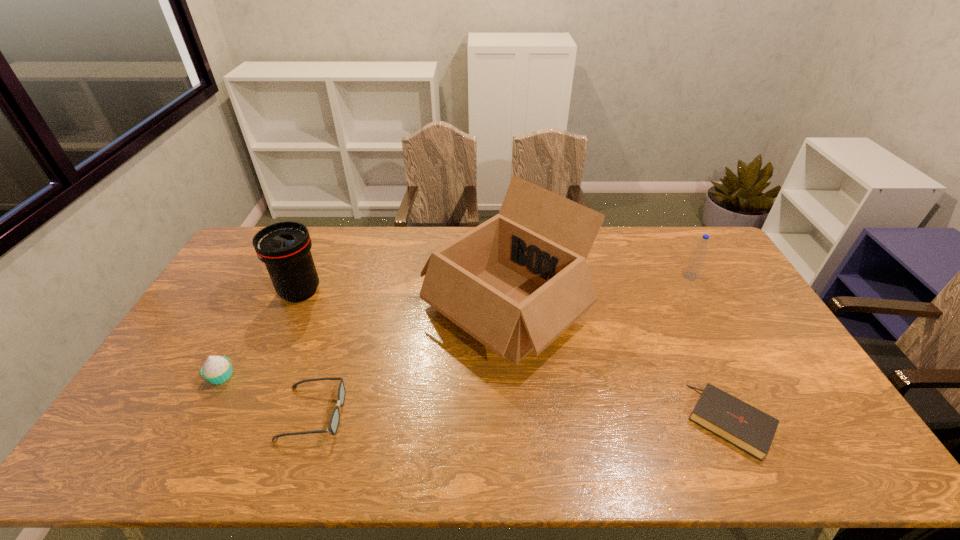
Locate an element on the screen. object present at the near right corner is located at coordinates (744, 426).

Find the location of a particular element. Image resolution: width=960 pixels, height=540 pixels. vacant space at the far edge of the desktop is located at coordinates (662, 233).

Find the location of a particular element. The image size is (960, 540). blank area at the near edge is located at coordinates (355, 442).

This screenshot has width=960, height=540. Find the location of `free spot at the left edge of the desktop`. free spot at the left edge of the desktop is located at coordinates (188, 364).

At what (x,y) coordinates should I click in order to perform the action: click on vacant space at the right edge of the desktop. Please return your answer as a coordinate pair (x, y). Looking at the image, I should click on (738, 294).

Find the location of `vacant space in between the spectacles and the shortest object`. vacant space in between the spectacles and the shortest object is located at coordinates (521, 417).

Identify the location of free space between the fourth object from left to right and the shortest object. Image resolution: width=960 pixels, height=540 pixels. (617, 364).

Identify the location of unoccupied position between the shortest object and the fourth shortest object. (710, 348).

Where is `vacant area that lies between the telephoto lens and the box`? The width and height of the screenshot is (960, 540). vacant area that lies between the telephoto lens and the box is located at coordinates (402, 300).

Where is `vacant space in between the fourth shortest object and the shortest object`? This screenshot has width=960, height=540. vacant space in between the fourth shortest object and the shortest object is located at coordinates (710, 348).